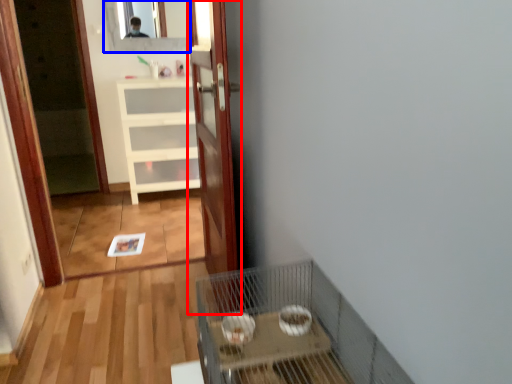
Question: Which object is closer to the camera taking this photo, door (highlighted by a red box) or mirror (highlighted by a blue box)?

Choices:
 (A) door
 (B) mirror

Answer: (A)